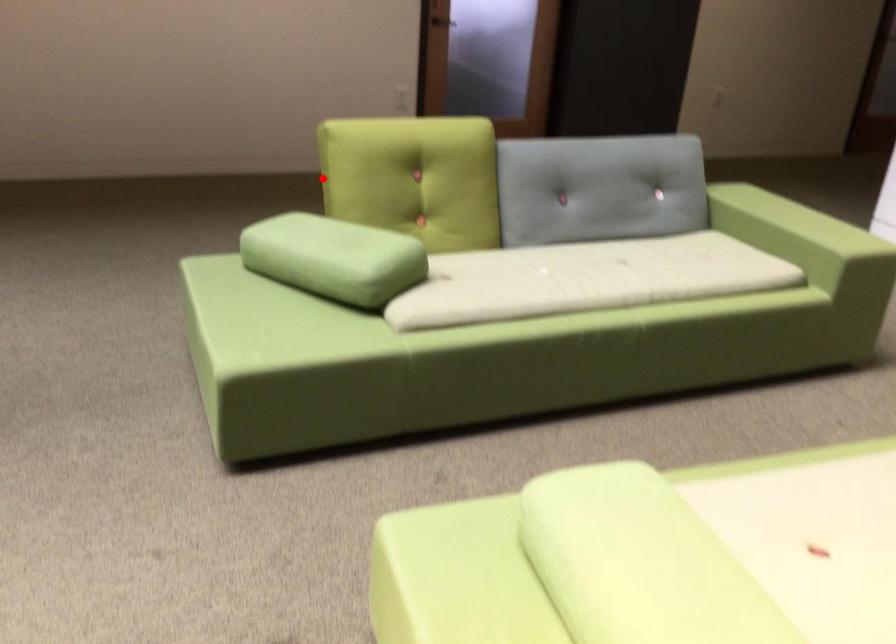
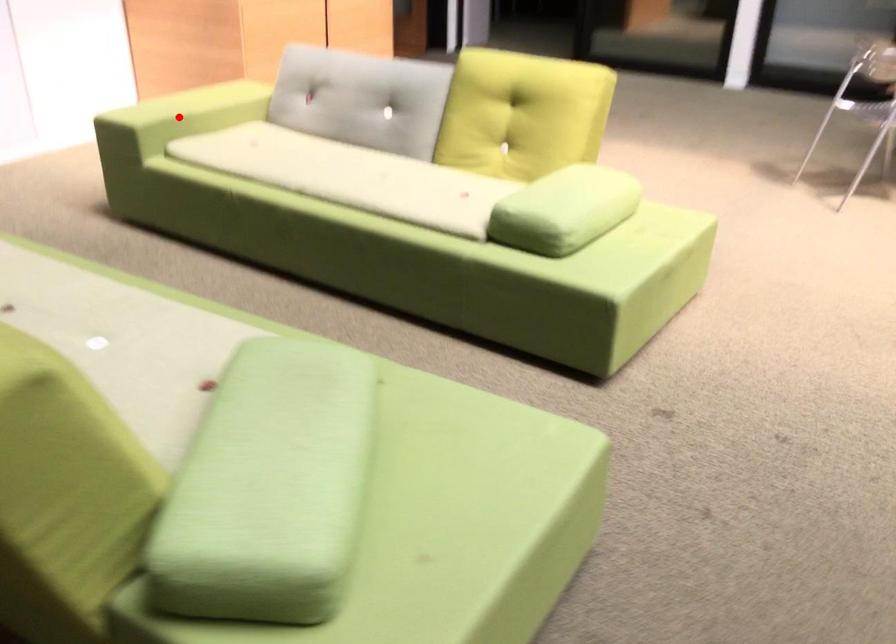
I am providing you with two images of the same scene from different viewpoints. A red point is marked on the first image and another point is marked on the second image. Is the marked point in image1 the same physical position as the marked point in image2?

No